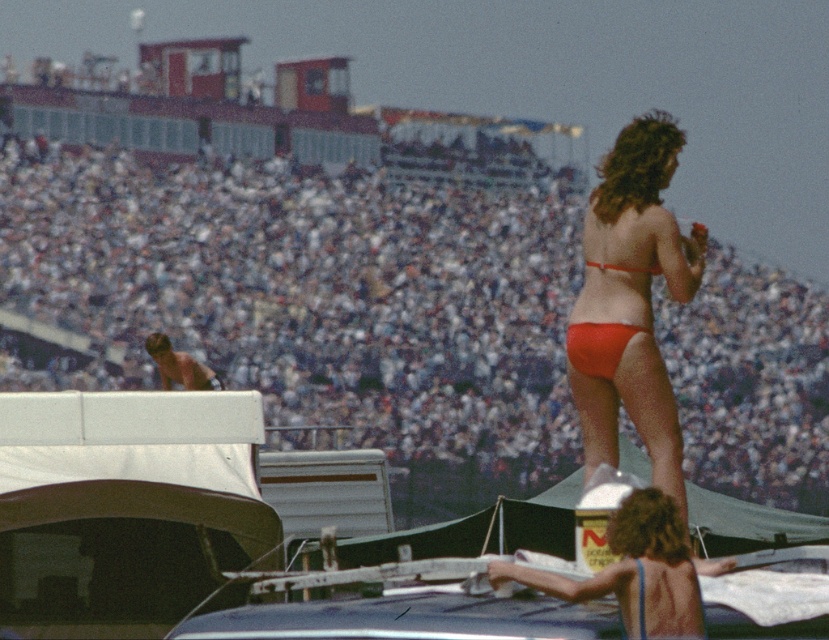
Is point (268, 349) closer to camera compared to point (604, 268)?

No, it is not.

Describe the element at coordinates (321, 301) in the screenshot. I see `white cotton crowd at upper center` at that location.

Where is `white cotton crowd at upper center`? The width and height of the screenshot is (829, 640). white cotton crowd at upper center is located at coordinates (321, 301).

Which is more to the right, white cotton crowd at upper center or orange matte bikini bottom at upper right?

From the viewer's perspective, orange matte bikini bottom at upper right appears more on the right side.

Can you confirm if white cotton crowd at upper center is bigger than orange matte bikini bottom at upper right?

Indeed, white cotton crowd at upper center has a larger size compared to orange matte bikini bottom at upper right.

Who is more distant from viewer, (245, 230) or (608, 163)?

The point (245, 230) is more distant.

Where is `white cotton crowd at upper center`? The width and height of the screenshot is (829, 640). white cotton crowd at upper center is located at coordinates (321, 301).

Where is `orange matte bikini bottom at upper right`? The image size is (829, 640). orange matte bikini bottom at upper right is located at coordinates (623, 376).

Can you confirm if orange matte bikini bottom at upper right is positioned above matte red bikini bottom at center?

Incorrect, orange matte bikini bottom at upper right is not positioned above matte red bikini bottom at center.

Is point (642, 417) positioned after point (624, 266)?

No.

Where is `orange matte bikini bottom at upper right`? This screenshot has height=640, width=829. orange matte bikini bottom at upper right is located at coordinates (623, 376).